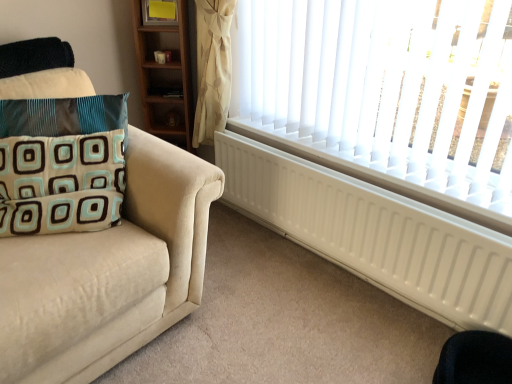
Question: Is white matte radiator at lower right wider than black fabric swivel chair at lower right?

Choices:
 (A) yes
 (B) no

Answer: (B)

Question: From a real-world perspective, is white matte radiator at lower right positioned under black fabric swivel chair at lower right based on gravity?

Choices:
 (A) no
 (B) yes

Answer: (A)

Question: Is white matte radiator at lower right outside of black fabric swivel chair at lower right?

Choices:
 (A) no
 (B) yes

Answer: (B)

Question: Does white matte radiator at lower right lie in front of black fabric swivel chair at lower right?

Choices:
 (A) yes
 (B) no

Answer: (B)

Question: Is white matte radiator at lower right to the left of black fabric swivel chair at lower right from the viewer's perspective?

Choices:
 (A) no
 (B) yes

Answer: (B)

Question: Does white matte radiator at lower right have a larger size compared to black fabric swivel chair at lower right?

Choices:
 (A) no
 (B) yes

Answer: (B)

Question: Does teal velvet pillow at left have a lesser height compared to white matte radiator at lower right?

Choices:
 (A) yes
 (B) no

Answer: (A)

Question: Is teal velvet pillow at left bigger than white matte radiator at lower right?

Choices:
 (A) yes
 (B) no

Answer: (B)

Question: Is teal velvet pillow at left not within white matte radiator at lower right?

Choices:
 (A) yes
 (B) no

Answer: (A)

Question: From a real-world perspective, is teal velvet pillow at left over white matte radiator at lower right?

Choices:
 (A) yes
 (B) no

Answer: (A)

Question: From the image's perspective, is teal velvet pillow at left on white matte radiator at lower right?

Choices:
 (A) no
 (B) yes

Answer: (B)

Question: Is teal velvet pillow at left in front of white matte radiator at lower right?

Choices:
 (A) no
 (B) yes

Answer: (B)

Question: From a real-world perspective, is black fabric swivel chair at lower right located higher than teal velvet pillow at left?

Choices:
 (A) yes
 (B) no

Answer: (B)